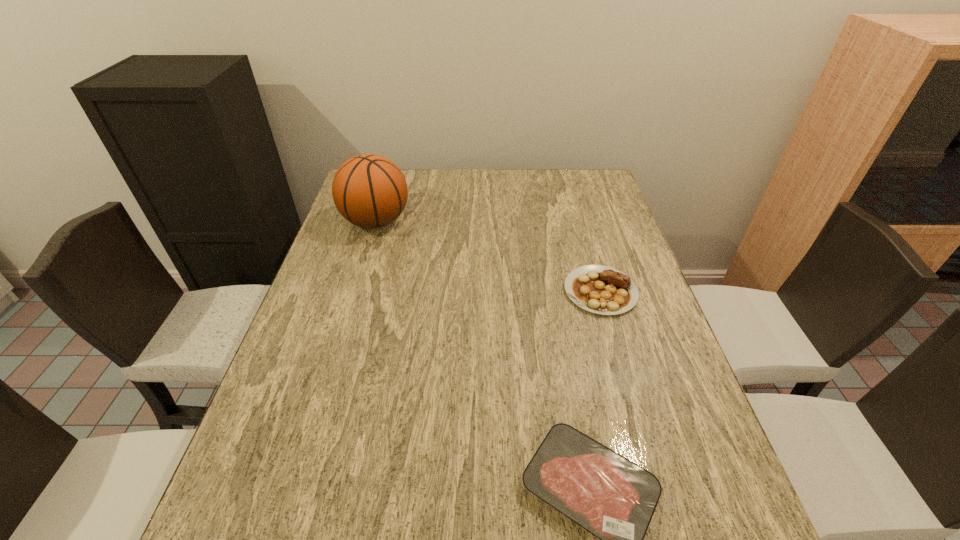
Locate an element on the screen. This screenshot has width=960, height=540. basketball is located at coordinates (370, 191).

Where is `the tallest object`? the tallest object is located at coordinates (370, 191).

Locate an element on the screen. The image size is (960, 540). the second tallest object is located at coordinates (599, 289).

Where is `the taller steak`? Image resolution: width=960 pixels, height=540 pixels. the taller steak is located at coordinates (599, 289).

Find the location of a particular element. vacant space located 0.240m on the front of the tallest object is located at coordinates (352, 299).

What are the coordinates of `vacant space situated 0.360m on the back of the taller steak` in the screenshot? It's located at (573, 199).

Locate an element on the screen. The height and width of the screenshot is (540, 960). object that is at the far edge is located at coordinates (370, 191).

The image size is (960, 540). What are the coordinates of `object that is at the left edge` in the screenshot? It's located at (370, 191).

Identify the location of object that is at the right edge. The image size is (960, 540). (599, 289).

Where is `object situated at the far left corner`? The height and width of the screenshot is (540, 960). object situated at the far left corner is located at coordinates (370, 191).